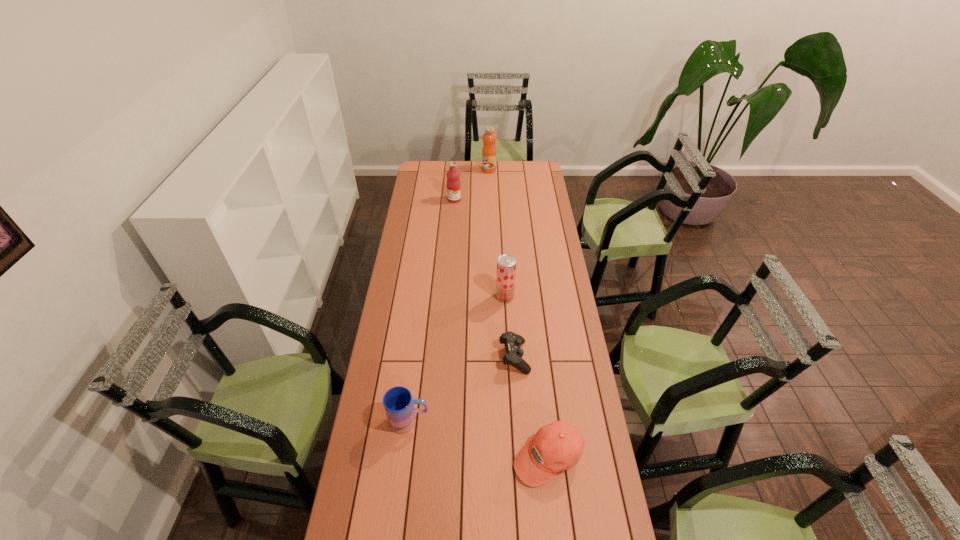
Identify the location of the tallest object. The width and height of the screenshot is (960, 540). (489, 137).

Identify the location of the farthest fruit juice. (489, 137).

You are a GUI agent. You are given a task and a screenshot of the screen. Output one action in this format:
    pyautogui.click(x=<x>, y=<y>)
    Task: Click on the leftmost fruit juice
    This screenshot has height=540, width=960.
    Given the screenshot: What is the action you would take?
    pyautogui.click(x=453, y=175)

This screenshot has height=540, width=960. Find the location of `the second nearest fruit juice`. the second nearest fruit juice is located at coordinates (453, 175).

Identify the location of the fourth nearest object. (506, 264).

Locate an element on the screen. The image size is (960, 540). mug is located at coordinates (398, 403).

Locate an element on the screen. the second shortest object is located at coordinates (557, 446).

At what (x,y) coordinates should I click in order to perform the action: click on control. Please return your answer as a coordinate pair (x, y). Image resolution: width=960 pixels, height=540 pixels. Looking at the image, I should click on (512, 342).

Locate an element on the screen. The height and width of the screenshot is (540, 960). the shortest object is located at coordinates [512, 342].

The height and width of the screenshot is (540, 960). In order to click on blank space located on the front of the tallest fruit juice in this screenshot , I will do `click(490, 198)`.